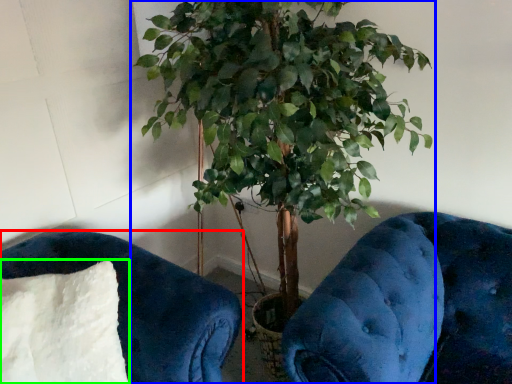
Question: Based on their relative distances, which object is nearer to furniture (highlighted by a red box)? Choose from houseplant (highlighted by a blue box) and pillow (highlighted by a green box).

Choices:
 (A) houseplant
 (B) pillow

Answer: (B)